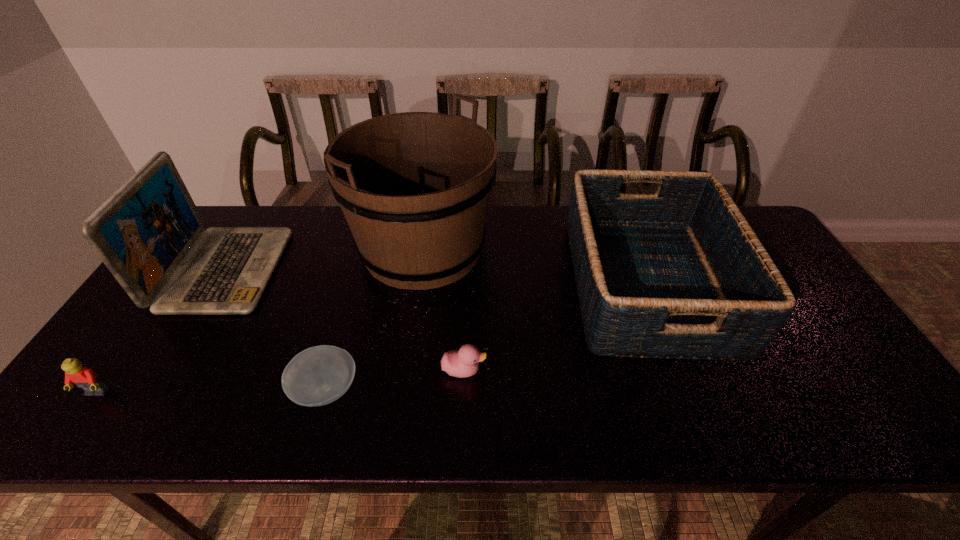
Locate an element on the screen. The image size is (960, 540). vacant region that satisfies the following two spatial constraints: 1. on the screen of the laptop computer; 2. on the back side of the shortest object is located at coordinates (154, 390).